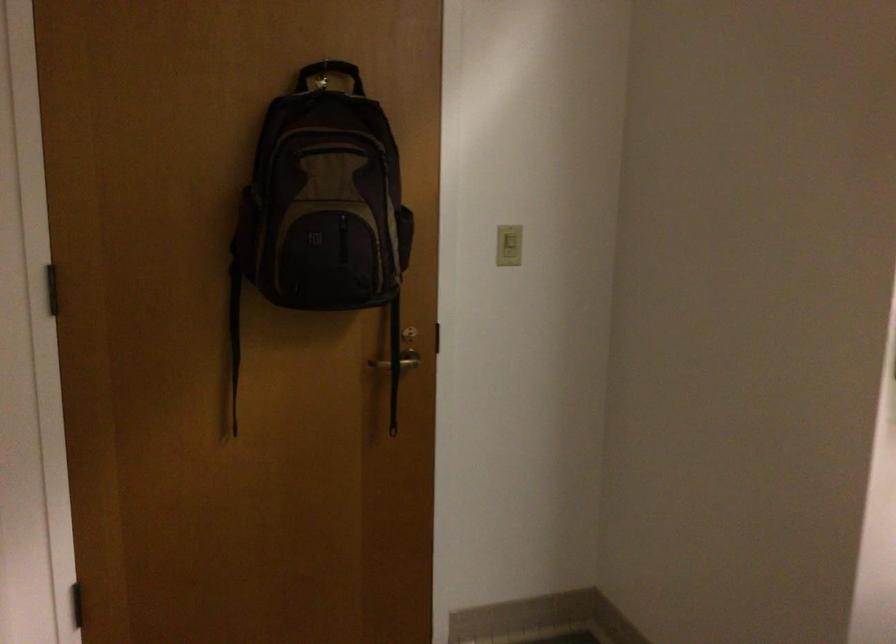
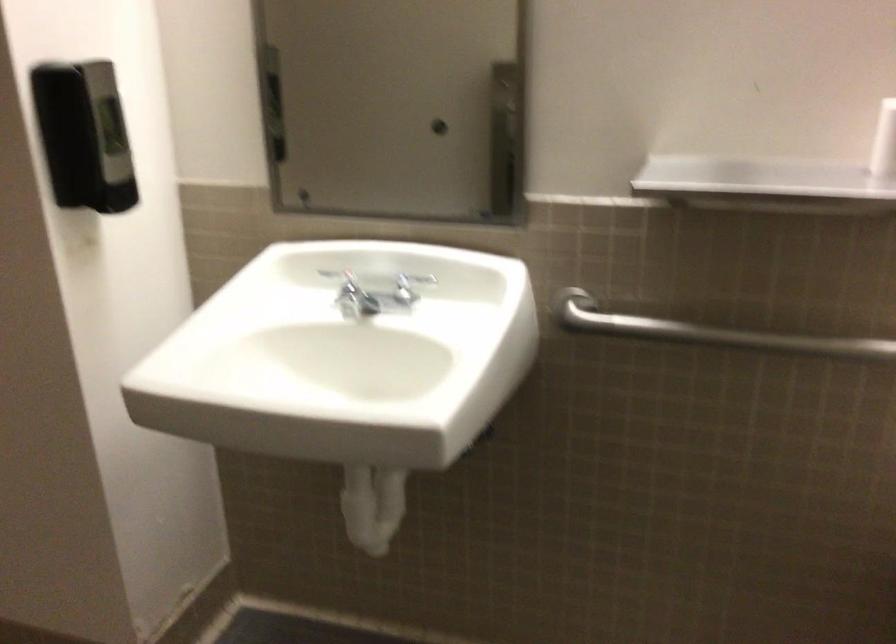
The first image is from the beginning of the video and the second image is from the end. How did the camera likely rotate when shooting the video?

The camera's rotation is toward right-down.